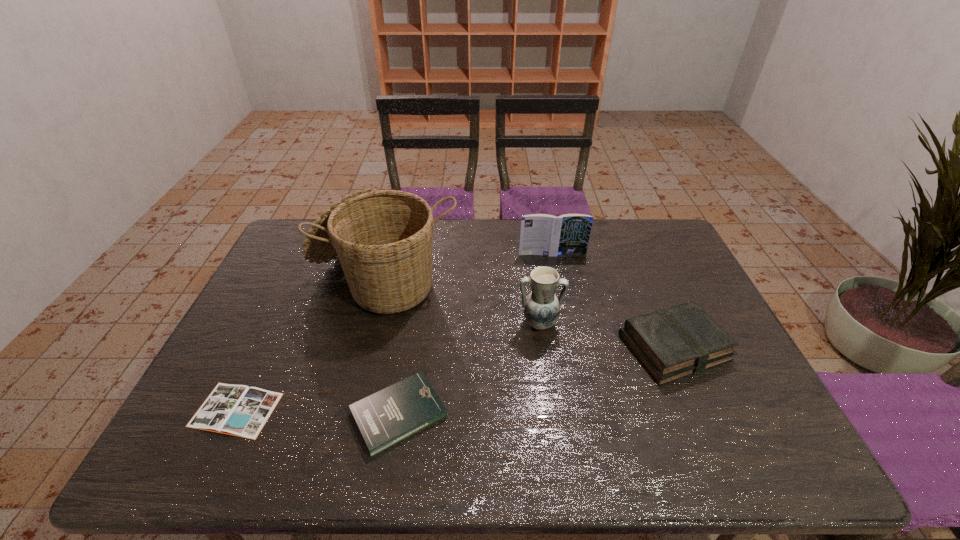
Where is `the tallest object`? the tallest object is located at coordinates (383, 238).

This screenshot has width=960, height=540. I want to click on pottery, so click(541, 307).

The width and height of the screenshot is (960, 540). Identify the location of the third book from left to right. (541, 234).

Locate an element on the screen. This screenshot has width=960, height=540. the farthest book is located at coordinates point(541,234).

The height and width of the screenshot is (540, 960). What are the coordinates of `the third shortest book` in the screenshot? It's located at (672, 343).

At what (x,y) coordinates should I click in order to perform the action: click on the rightmost book. Please return your answer as a coordinate pair (x, y). Looking at the image, I should click on (672, 343).

You are a GUI agent. You are given a task and a screenshot of the screen. Output one action in this format:
    pyautogui.click(x=<x>, y=<y>)
    Task: Click on the second book from left to right
    Image resolution: width=960 pixels, height=540 pixels.
    Given the screenshot: What is the action you would take?
    pyautogui.click(x=392, y=414)

What are the coordinates of `the second shortest book` in the screenshot? It's located at (392, 414).

Locate an element on the screen. the shortest book is located at coordinates (238, 410).

The image size is (960, 540). What are the coordinates of `the leftmost book` in the screenshot? It's located at (238, 410).